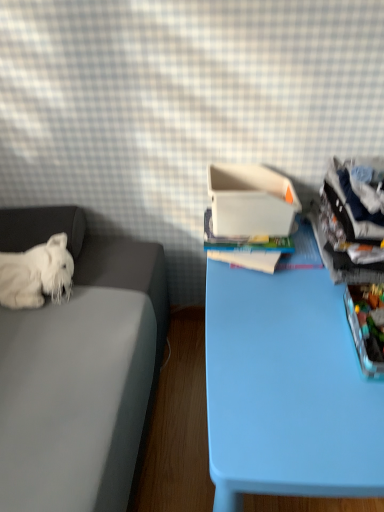
What are the coordinates of `empty space that is ontop of light blue plastic table at center (from a real-world perspective)` in the screenshot? It's located at (292, 337).